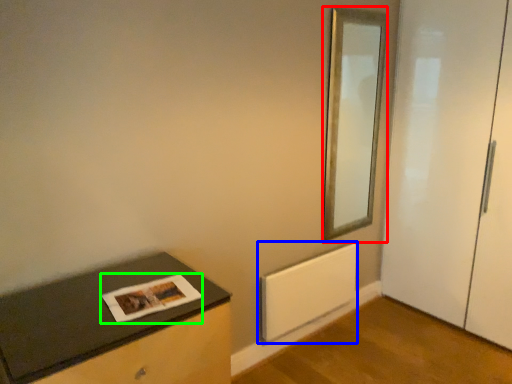
Question: Based on their relative distances, which object is farther from mirror (highlighted by a red box)? Choose from radiator (highlighted by a blue box) and magazine (highlighted by a green box).

Choices:
 (A) radiator
 (B) magazine

Answer: (B)